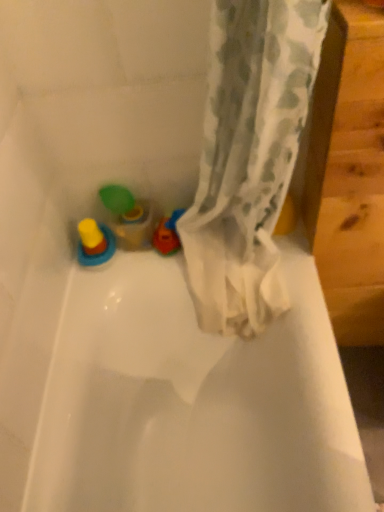
What is the approximate height of yellow rubber ring at lower left, which appears as the 2th toy when viewed from the right?

yellow rubber ring at lower left, which appears as the 2th toy when viewed from the right, is 3.55 inches tall.

At what (x,y) coordinates should I click in order to perform the action: click on yellow rubber ring at lower left, which appears as the 2th toy when viewed from the right. Please return your answer as a coordinate pair (x, y). Looking at the image, I should click on (95, 243).

Describe the element at coordinates (95, 243) in the screenshot. The height and width of the screenshot is (512, 384). I see `yellow rubber ring at lower left, which is the 1th toy in left-to-right order` at that location.

In the scene shown: Measure the distance between point (118,224) and camera.

1.27 meters.

The width and height of the screenshot is (384, 512). In order to click on translucent plastic cup at left, which is counted as the first toy, starting from the right in this screenshot , I will do `click(134, 226)`.

What do you see at coordinates (134, 226) in the screenshot? The width and height of the screenshot is (384, 512). I see `translucent plastic cup at left, which is counted as the first toy, starting from the right` at bounding box center [134, 226].

How much space does translucent plastic cup at left, which appears as the second toy when viewed from the left, occupy horizontally?

3.14 inches.

You are a GUI agent. You are given a task and a screenshot of the screen. Output one action in this format:
    pyautogui.click(x=<x>, y=<y>)
    Task: Click on the yellow rubber ring at lower left, which appears as the 2th toy when viewed from the right
    
    Given the screenshot: What is the action you would take?
    pyautogui.click(x=95, y=243)

Is translucent plastic cup at left, which is counted as the first toy, starting from the right, at the right side of yellow rubber ring at lower left, which is the 1th toy in left-to-right order?

Yes.

Is translucent plastic cup at left, which appears as the second toy when viewed from the left, further to camera compared to yellow rubber ring at lower left, which is the 1th toy in left-to-right order?

That is True.

Considering the points (137, 210) and (94, 252), which point is behind, point (137, 210) or point (94, 252)?

Point (137, 210)

From the image's perspective, which one is positioned higher, translucent plastic cup at left, which appears as the second toy when viewed from the left, or yellow rubber ring at lower left, which appears as the 2th toy when viewed from the right?

translucent plastic cup at left, which appears as the second toy when viewed from the left, is shown above in the image.

From a real-world perspective, is translucent plastic cup at left, which is counted as the first toy, starting from the right, physically above yellow rubber ring at lower left, which is the 1th toy in left-to-right order?

No, from a real-world perspective, translucent plastic cup at left, which is counted as the first toy, starting from the right, is not over yellow rubber ring at lower left, which is the 1th toy in left-to-right order

Is translucent plastic cup at left, which is counted as the first toy, starting from the right, wider than yellow rubber ring at lower left, which is the 1th toy in left-to-right order?

No.

Considering the relative sizes of translucent plastic cup at left, which appears as the second toy when viewed from the left, and yellow rubber ring at lower left, which appears as the 2th toy when viewed from the right, in the image provided, is translucent plastic cup at left, which appears as the second toy when viewed from the left, shorter than yellow rubber ring at lower left, which appears as the 2th toy when viewed from the right,?

In fact, translucent plastic cup at left, which appears as the second toy when viewed from the left, may be taller than yellow rubber ring at lower left, which appears as the 2th toy when viewed from the right.

Who is smaller, translucent plastic cup at left, which is counted as the first toy, starting from the right, or yellow rubber ring at lower left, which appears as the 2th toy when viewed from the right?

yellow rubber ring at lower left, which appears as the 2th toy when viewed from the right.

Is yellow rubber ring at lower left, which is the 1th toy in left-to-right order, completely or partially inside translucent plastic cup at left, which is counted as the first toy, starting from the right?

No, yellow rubber ring at lower left, which is the 1th toy in left-to-right order, is not a part of translucent plastic cup at left, which is counted as the first toy, starting from the right.

Is translucent plastic cup at left, which is counted as the first toy, starting from the right, not near yellow rubber ring at lower left, which is the 1th toy in left-to-right order?

No, there isn't a large distance between translucent plastic cup at left, which is counted as the first toy, starting from the right, and yellow rubber ring at lower left, which is the 1th toy in left-to-right order.

Is translucent plastic cup at left, which appears as the second toy when viewed from the left, positioned with its back to yellow rubber ring at lower left, which appears as the 2th toy when viewed from the right?

No, yellow rubber ring at lower left, which appears as the 2th toy when viewed from the right, is not at the back of translucent plastic cup at left, which appears as the second toy when viewed from the left.

The image size is (384, 512). Identify the location of toy that appears on the left of translucent plastic cup at left, which is counted as the first toy, starting from the right. (95, 243).

Is yellow rubber ring at lower left, which is the 1th toy in left-to-right order, at the left side of translucent plastic cup at left, which is counted as the first toy, starting from the right?

Yes, yellow rubber ring at lower left, which is the 1th toy in left-to-right order, is to the left of translucent plastic cup at left, which is counted as the first toy, starting from the right.

Is the position of yellow rubber ring at lower left, which is the 1th toy in left-to-right order, less distant than that of translucent plastic cup at left, which appears as the second toy when viewed from the left?

Yes, yellow rubber ring at lower left, which is the 1th toy in left-to-right order, is closer to the viewer.

Is point (115, 240) positioned after point (125, 239)?

Yes, it is behind point (125, 239).

From the image's perspective, is yellow rubber ring at lower left, which appears as the 2th toy when viewed from the right, below translucent plastic cup at left, which is counted as the first toy, starting from the right?

Yes, from the image's perspective, yellow rubber ring at lower left, which appears as the 2th toy when viewed from the right, is below translucent plastic cup at left, which is counted as the first toy, starting from the right.

From a real-world perspective, which object stands above the other?

yellow rubber ring at lower left, which is the 1th toy in left-to-right order.

Looking at their sizes, would you say yellow rubber ring at lower left, which is the 1th toy in left-to-right order, is wider or thinner than translucent plastic cup at left, which appears as the second toy when viewed from the left?

Considering their sizes, yellow rubber ring at lower left, which is the 1th toy in left-to-right order, looks broader than translucent plastic cup at left, which appears as the second toy when viewed from the left.

From the picture: Which of these two, yellow rubber ring at lower left, which appears as the 2th toy when viewed from the right, or translucent plastic cup at left, which appears as the second toy when viewed from the left, stands taller?

With more height is translucent plastic cup at left, which appears as the second toy when viewed from the left.

In terms of size, does yellow rubber ring at lower left, which is the 1th toy in left-to-right order, appear bigger or smaller than translucent plastic cup at left, which is counted as the first toy, starting from the right?

yellow rubber ring at lower left, which is the 1th toy in left-to-right order, is smaller than translucent plastic cup at left, which is counted as the first toy, starting from the right.

Is translucent plastic cup at left, which is counted as the first toy, starting from the right, located within yellow rubber ring at lower left, which appears as the 2th toy when viewed from the right?

That's incorrect, translucent plastic cup at left, which is counted as the first toy, starting from the right, is not inside yellow rubber ring at lower left, which appears as the 2th toy when viewed from the right.

Are yellow rubber ring at lower left, which is the 1th toy in left-to-right order, and translucent plastic cup at left, which is counted as the first toy, starting from the right, making contact?

Absolutely, yellow rubber ring at lower left, which is the 1th toy in left-to-right order, is next to and touching translucent plastic cup at left, which is counted as the first toy, starting from the right.

Is yellow rubber ring at lower left, which is the 1th toy in left-to-right order, facing away from translucent plastic cup at left, which is counted as the first toy, starting from the right?

yellow rubber ring at lower left, which is the 1th toy in left-to-right order, does not have its back to translucent plastic cup at left, which is counted as the first toy, starting from the right.

The image size is (384, 512). I want to click on toy below the translucent plastic cup at left, which is counted as the first toy, starting from the right (from the image's perspective), so click(x=95, y=243).

Identify the location of toy located underneath the yellow rubber ring at lower left, which appears as the 2th toy when viewed from the right (from a real-world perspective). (134, 226).

Locate an element on the screen. The width and height of the screenshot is (384, 512). toy on the left of translucent plastic cup at left, which appears as the second toy when viewed from the left is located at coordinates (95, 243).